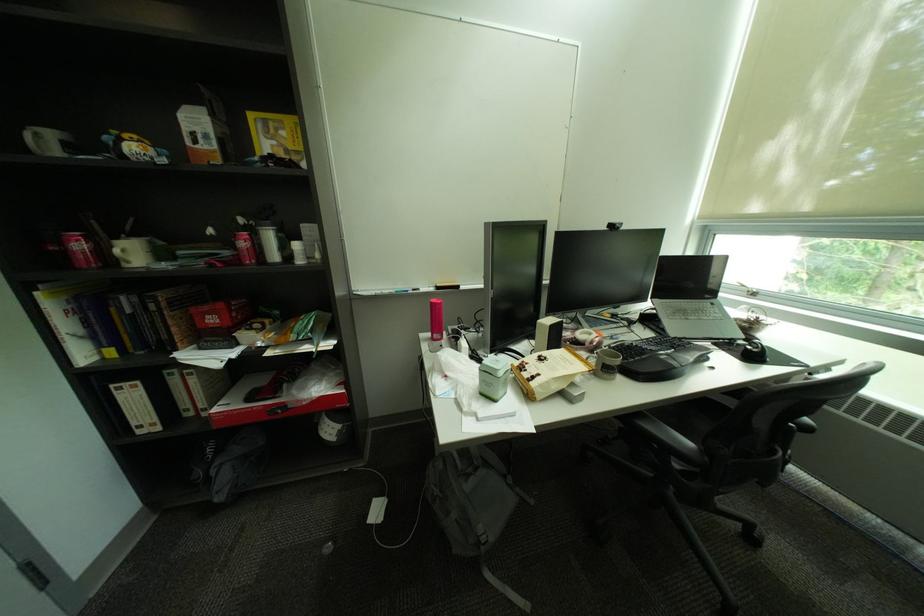
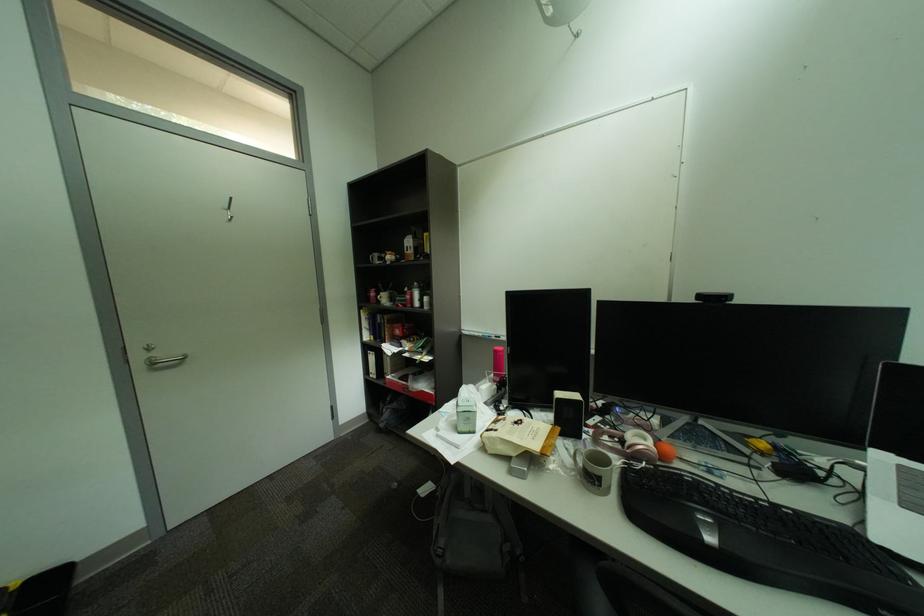
Question: The images are taken continuously from a first-person perspective. In which direction is your viewpoint rotating?

Choices:
 (A) Left
 (B) Right
 (C) Up
 (D) Down

Answer: (A)